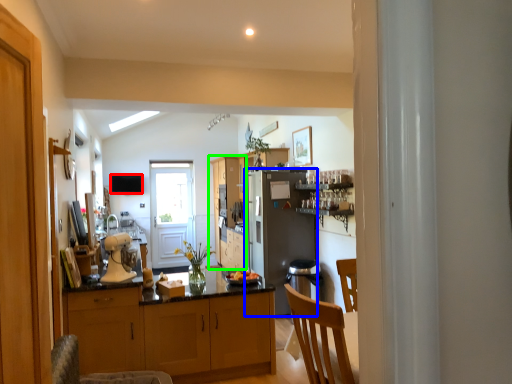
Question: Which is nearer to the television (highlighted by a red box)? refrigerator (highlighted by a blue box) or cabinetry (highlighted by a green box).

Choices:
 (A) refrigerator
 (B) cabinetry

Answer: (B)